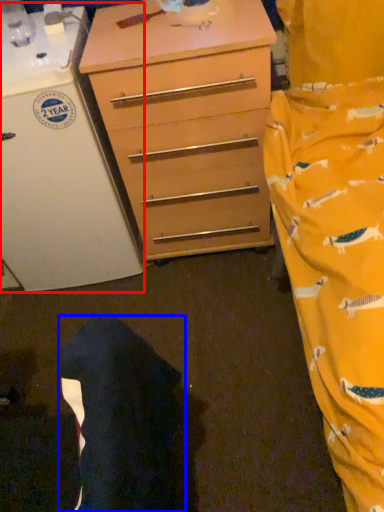
Question: Which of the following is the farthest to the observer, appliance (highlighted by a red box) or robe (highlighted by a blue box)?

Choices:
 (A) appliance
 (B) robe

Answer: (A)